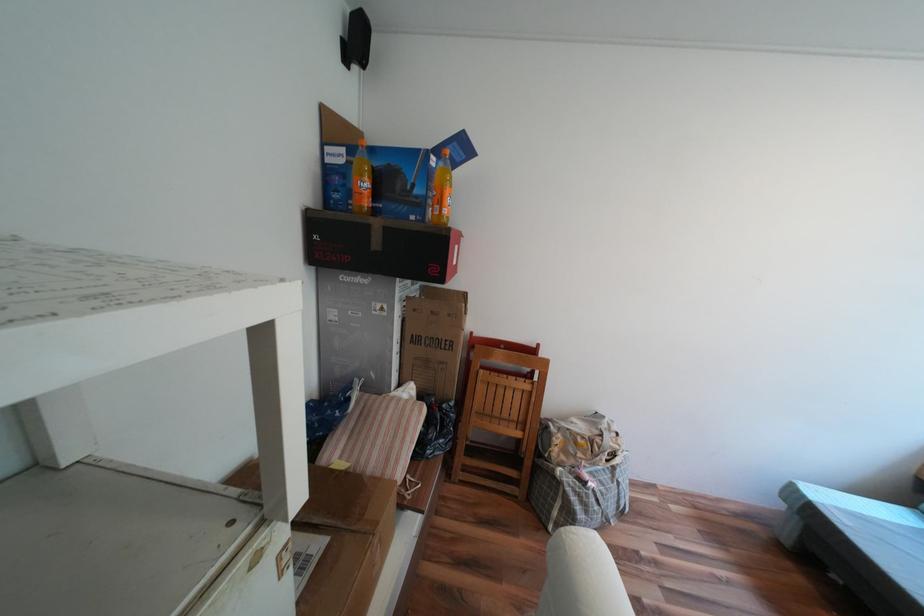
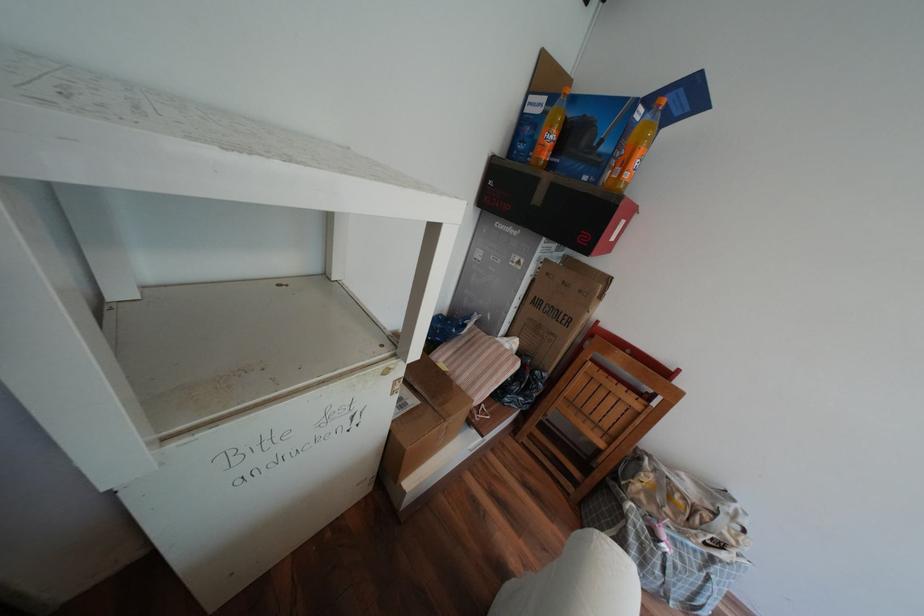
Where in the second image is the point corresponding to (327,544) from the first image?

(422, 400)